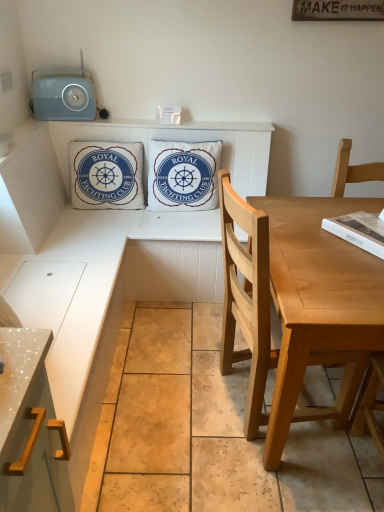
What do you see at coordinates (183, 175) in the screenshot? I see `white cotton cushion at center, the second pillow when ordered from left to right` at bounding box center [183, 175].

Describe the element at coordinates (63, 94) in the screenshot. The height and width of the screenshot is (512, 384). I see `matte blue radio at upper left` at that location.

The image size is (384, 512). I want to click on light wood chair at right, so click(x=246, y=296).

Locate an element on the screen. The width and height of the screenshot is (384, 512). white cotton cushion at center, positioned as the 1th pillow in right-to-left order is located at coordinates (183, 175).

What's the angular difference between matte blue radio at upper left and white cotton cushion at upper center, which is counted as the 2th pillow, starting from the right,'s facing directions?

2 degrees.

Looking at the image, does matte blue radio at upper left seem bigger or smaller compared to white cotton cushion at upper center, which is counted as the 2th pillow, starting from the right?

In the image, matte blue radio at upper left appears to be smaller than white cotton cushion at upper center, which is counted as the 2th pillow, starting from the right.

Which object is closer to the camera taking this photo, matte blue radio at upper left or white cotton cushion at upper center, the first pillow viewed from the left?

matte blue radio at upper left.

From a real-world perspective, between matte blue radio at upper left and white cotton cushion at upper center, which is counted as the 2th pillow, starting from the right, who is vertically lower?

In real-world perspective, white cotton cushion at upper center, which is counted as the 2th pillow, starting from the right, is lower.

Does matte blue radio at upper left have a lesser height compared to metallic gold cabinet handle at lower left?

Yes, matte blue radio at upper left is shorter than metallic gold cabinet handle at lower left.

From the image's perspective, which one is positioned lower, matte blue radio at upper left or metallic gold cabinet handle at lower left?

From the image's view, metallic gold cabinet handle at lower left is below.

Does matte blue radio at upper left turn towards metallic gold cabinet handle at lower left?

Yes, matte blue radio at upper left is oriented towards metallic gold cabinet handle at lower left.

Considering the relative sizes of matte blue radio at upper left and metallic gold cabinet handle at lower left in the image provided, is matte blue radio at upper left thinner than metallic gold cabinet handle at lower left?

Indeed, matte blue radio at upper left has a lesser width compared to metallic gold cabinet handle at lower left.

From the image's perspective, is white cotton cushion at upper center, which is counted as the 2th pillow, starting from the right, located above or below light wood chair at right?

From the image's perspective, white cotton cushion at upper center, which is counted as the 2th pillow, starting from the right, appears above light wood chair at right.

Which point is more distant from viewer, (138, 161) or (255, 209)?

Point (138, 161)

Which of these two, white cotton cushion at upper center, the first pillow viewed from the left, or light wood chair at right, is wider?

Wider between the two is light wood chair at right.

From a real-world perspective, which object stands above the other?

white cotton cushion at upper center, which is counted as the 2th pillow, starting from the right, from a real-world perspective.

Considering the relative sizes of metallic gold cabinet handle at lower left and white cotton cushion at upper center, which is counted as the 2th pillow, starting from the right, in the image provided, is metallic gold cabinet handle at lower left shorter than white cotton cushion at upper center, which is counted as the 2th pillow, starting from the right,?

No.

Which is behind, metallic gold cabinet handle at lower left or white cotton cushion at upper center, which is counted as the 2th pillow, starting from the right?

Positioned behind is white cotton cushion at upper center, which is counted as the 2th pillow, starting from the right.

Is metallic gold cabinet handle at lower left oriented towards white cotton cushion at upper center, the first pillow viewed from the left?

No, metallic gold cabinet handle at lower left is not oriented towards white cotton cushion at upper center, the first pillow viewed from the left.

Considering the relative positions of metallic gold cabinet handle at lower left and white cotton cushion at upper center, which is counted as the 2th pillow, starting from the right, in the image provided, is metallic gold cabinet handle at lower left to the left or to the right of white cotton cushion at upper center, which is counted as the 2th pillow, starting from the right,?

From the image, it's evident that metallic gold cabinet handle at lower left is to the right of white cotton cushion at upper center, which is counted as the 2th pillow, starting from the right.

From the image's perspective, does matte blue radio at upper left appear higher than white cotton cushion at center, positioned as the 1th pillow in right-to-left order?

Indeed, from the image's perspective, matte blue radio at upper left is shown above white cotton cushion at center, positioned as the 1th pillow in right-to-left order.

Is matte blue radio at upper left in contact with white cotton cushion at center, positioned as the 1th pillow in right-to-left order?

No, matte blue radio at upper left is not in contact with white cotton cushion at center, positioned as the 1th pillow in right-to-left order.

Measure the distance between matte blue radio at upper left and white cotton cushion at center, positioned as the 1th pillow in right-to-left order.

A distance of 23.66 inches exists between matte blue radio at upper left and white cotton cushion at center, positioned as the 1th pillow in right-to-left order.

You are a GUI agent. You are given a task and a screenshot of the screen. Output one action in this format:
    pyautogui.click(x=<x>, y=<y>)
    Task: Click on the 2nd pillow to the right of the matte blue radio at upper left, starting your count from the anchor
    
    Given the screenshot: What is the action you would take?
    pyautogui.click(x=183, y=175)

Can matte blue radio at upper left be found inside white cotton cushion at center, positioned as the 1th pillow in right-to-left order?

No, white cotton cushion at center, positioned as the 1th pillow in right-to-left order, does not contain matte blue radio at upper left.

Considering the sizes of objects white cotton cushion at center, positioned as the 1th pillow in right-to-left order, and matte blue radio at upper left in the image provided, who is shorter, white cotton cushion at center, positioned as the 1th pillow in right-to-left order, or matte blue radio at upper left?

Standing shorter between the two is matte blue radio at upper left.

Which of these two, white cotton cushion at center, positioned as the 1th pillow in right-to-left order, or matte blue radio at upper left, is smaller?

matte blue radio at upper left.

Is white cotton cushion at center, the second pillow when ordered from left to right, not near matte blue radio at upper left?

Actually, white cotton cushion at center, the second pillow when ordered from left to right, and matte blue radio at upper left are a little close together.

From the image's perspective, is light wood chair at right located beneath matte blue radio at upper left?

Correct, light wood chair at right appears lower than matte blue radio at upper left in the image.

Which is more to the right, light wood chair at right or matte blue radio at upper left?

light wood chair at right.

Which of these two, light wood chair at right or matte blue radio at upper left, stands taller?

With more height is light wood chair at right.

Are light wood chair at right and matte blue radio at upper left making contact?

No, light wood chair at right is not beside matte blue radio at upper left.

What are the coordinates of `radio positioned vertically above the white cotton cushion at upper center, which is counted as the 2th pillow, starting from the right (from a real-world perspective)` in the screenshot? It's located at (63, 94).

The height and width of the screenshot is (512, 384). In order to click on cabinetry located in front of the matte blue radio at upper left in this screenshot , I will do `click(29, 426)`.

Based on their spatial positions, is white cotton cushion at upper center, which is counted as the 2th pillow, starting from the right, or white cotton cushion at center, the second pillow when ordered from left to right, closer to light wood chair at right?

Among the two, white cotton cushion at center, the second pillow when ordered from left to right, is located nearer to light wood chair at right.

Considering their positions, is white cotton cushion at center, positioned as the 1th pillow in right-to-left order, positioned further to matte blue radio at upper left than metallic gold cabinet handle at lower left?

metallic gold cabinet handle at lower left is further to matte blue radio at upper left.

From the image, which object appears to be nearer to matte blue radio at upper left, white cotton cushion at center, positioned as the 1th pillow in right-to-left order, or light wood chair at right?

Based on the image, white cotton cushion at center, positioned as the 1th pillow in right-to-left order, appears to be nearer to matte blue radio at upper left.

Estimate the real-world distances between objects in this image. Which object is further from light wood chair at right, white cotton cushion at center, positioned as the 1th pillow in right-to-left order, or matte blue radio at upper left?

matte blue radio at upper left.

Based on their spatial positions, is white cotton cushion at upper center, which is counted as the 2th pillow, starting from the right, or metallic gold cabinet handle at lower left further from matte blue radio at upper left?

metallic gold cabinet handle at lower left is further to matte blue radio at upper left.

Estimate the real-world distances between objects in this image. Which object is closer to matte blue radio at upper left, metallic gold cabinet handle at lower left or white cotton cushion at center, the second pillow when ordered from left to right?

white cotton cushion at center, the second pillow when ordered from left to right, lies closer to matte blue radio at upper left than the other object.

Which object lies further to the anchor point light wood chair at right, metallic gold cabinet handle at lower left or white cotton cushion at upper center, the first pillow viewed from the left?

Among the two, white cotton cushion at upper center, the first pillow viewed from the left, is located further to light wood chair at right.

Which object lies nearer to the anchor point white cotton cushion at center, positioned as the 1th pillow in right-to-left order, matte blue radio at upper left or metallic gold cabinet handle at lower left?

matte blue radio at upper left is positioned closer to the anchor white cotton cushion at center, positioned as the 1th pillow in right-to-left order.

You are a GUI agent. You are given a task and a screenshot of the screen. Output one action in this format:
    pyautogui.click(x=<x>, y=<y>)
    Task: Click on the chair between metallic gold cabinet handle at lower left and white cotton cushion at center, the second pillow when ordered from left to right, in the front-back direction
    
    Given the screenshot: What is the action you would take?
    pyautogui.click(x=246, y=296)

Find the location of a particular element. chair positioned between metallic gold cabinet handle at lower left and white cotton cushion at upper center, the first pillow viewed from the left, from near to far is located at coordinates (246, 296).

Locate an element on the screen. This screenshot has width=384, height=512. pillow between metallic gold cabinet handle at lower left and white cotton cushion at center, positioned as the 1th pillow in right-to-left order, in the front-back direction is located at coordinates (106, 175).

Locate an element on the screen. The width and height of the screenshot is (384, 512). pillow between light wood chair at right and white cotton cushion at center, the second pillow when ordered from left to right, in the front-back direction is located at coordinates (106, 175).